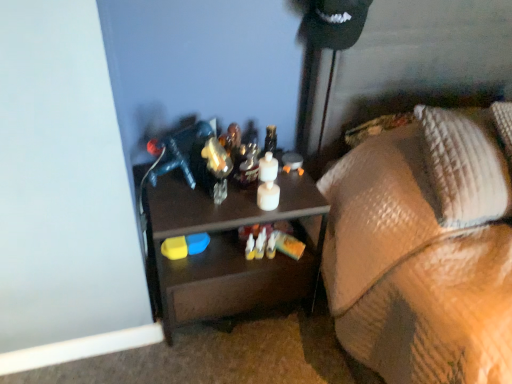
The width and height of the screenshot is (512, 384). I want to click on brown matte desk at center, so click(228, 250).

Locate an element on the screen. textured brown blanket at lower right is located at coordinates pyautogui.click(x=423, y=251).

Measure the distance between textured brown blanket at lower right and camera.

33.75 inches.

What do you see at coordinates (464, 168) in the screenshot? I see `woven fabric pillow at right` at bounding box center [464, 168].

The width and height of the screenshot is (512, 384). I want to click on brown matte desk at center, so click(228, 250).

From a real-world perspective, which is physically above, woven fabric pillow at right or brown matte desk at center?

woven fabric pillow at right, from a real-world perspective.

From the image's perspective, which one is positioned higher, woven fabric pillow at right or brown matte desk at center?

woven fabric pillow at right, from the image's perspective.

In the scene shown: Can you confirm if woven fabric pillow at right is smaller than brown matte desk at center?

Yes.

Is woven fabric pillow at right taller or shorter than textured brown blanket at lower right?

Considering their sizes, woven fabric pillow at right has less height than textured brown blanket at lower right.

From a real-world perspective, is woven fabric pillow at right over textured brown blanket at lower right?

Yes.

What's the angular difference between woven fabric pillow at right and textured brown blanket at lower right's facing directions?

2.11 degrees separate the facing orientations of woven fabric pillow at right and textured brown blanket at lower right.

Considering the relative sizes of brown matte desk at center and woven fabric pillow at right in the image provided, is brown matte desk at center smaller than woven fabric pillow at right?

Incorrect, brown matte desk at center is not smaller in size than woven fabric pillow at right.

Can you tell me how much brown matte desk at center and woven fabric pillow at right differ in facing direction?

brown matte desk at center and woven fabric pillow at right are facing 2.4 degrees away from each other.

Is brown matte desk at center positioned in front of woven fabric pillow at right?

No, it is not.

From a real-world perspective, is brown matte desk at center positioned under woven fabric pillow at right based on gravity?

Correct, in the physical world, brown matte desk at center is lower than woven fabric pillow at right.

Who is smaller, textured brown blanket at lower right or brown matte desk at center?

Smaller between the two is brown matte desk at center.

Is textured brown blanket at lower right facing towards brown matte desk at center?

No, textured brown blanket at lower right is not aimed at brown matte desk at center.

From the picture: Is brown matte desk at center a part of textured brown blanket at lower right?

Definitely not — brown matte desk at center is not inside textured brown blanket at lower right.

Where is `desk directly beneath the textured brown blanket at lower right (from a real-world perspective)`? The image size is (512, 384). desk directly beneath the textured brown blanket at lower right (from a real-world perspective) is located at coordinates (228, 250).

This screenshot has width=512, height=384. What are the coordinates of `pillow above the textured brown blanket at lower right (from the image's perspective)` in the screenshot? It's located at (464, 168).

Based on their sizes in the image, would you say textured brown blanket at lower right is bigger or smaller than woven fabric pillow at right?

In the image, textured brown blanket at lower right appears to be larger than woven fabric pillow at right.

Does textured brown blanket at lower right turn towards woven fabric pillow at right?

No, textured brown blanket at lower right is not turned towards woven fabric pillow at right.

Would you say textured brown blanket at lower right is to the left or to the right of woven fabric pillow at right in the picture?

Based on their positions, textured brown blanket at lower right is located to the left of woven fabric pillow at right.

Could you tell me if brown matte desk at center is facing textured brown blanket at lower right?

No, brown matte desk at center does not turn towards textured brown blanket at lower right.

Which of these two, brown matte desk at center or textured brown blanket at lower right, is smaller?

brown matte desk at center.

Which of these two, brown matte desk at center or textured brown blanket at lower right, stands shorter?

brown matte desk at center.

Locate an element on the screen. This screenshot has width=512, height=384. desk that is on the left side of woven fabric pillow at right is located at coordinates (228, 250).

You are a GUI agent. You are given a task and a screenshot of the screen. Output one action in this format:
    pyautogui.click(x=<x>, y=<y>)
    Task: Click on the furniture in front of the woven fabric pillow at right
    Image resolution: width=512 pixels, height=384 pixels.
    Given the screenshot: What is the action you would take?
    pyautogui.click(x=423, y=251)

Estimate the real-world distances between objects in this image. Which object is closer to brown matte desk at center, woven fabric pillow at right or textured brown blanket at lower right?

textured brown blanket at lower right is positioned closer to the anchor brown matte desk at center.

Estimate the real-world distances between objects in this image. Which object is closer to woven fabric pillow at right, brown matte desk at center or textured brown blanket at lower right?

The object closer to woven fabric pillow at right is textured brown blanket at lower right.

From the image, which object appears to be farther from brown matte desk at center, textured brown blanket at lower right or woven fabric pillow at right?

Based on the image, woven fabric pillow at right appears to be further to brown matte desk at center.

When comparing their distances from textured brown blanket at lower right, does brown matte desk at center or woven fabric pillow at right seem closer?

Based on the image, woven fabric pillow at right appears to be nearer to textured brown blanket at lower right.

Based on their spatial positions, is textured brown blanket at lower right or brown matte desk at center closer to woven fabric pillow at right?

textured brown blanket at lower right lies closer to woven fabric pillow at right than the other object.

Considering their positions, is woven fabric pillow at right positioned further to textured brown blanket at lower right than brown matte desk at center?

The object further to textured brown blanket at lower right is brown matte desk at center.

At what (x,y) coordinates should I click in order to perform the action: click on furniture between brown matte desk at center and woven fabric pillow at right in the horizontal direction. Please return your answer as a coordinate pair (x, y). Image resolution: width=512 pixels, height=384 pixels. Looking at the image, I should click on (423, 251).